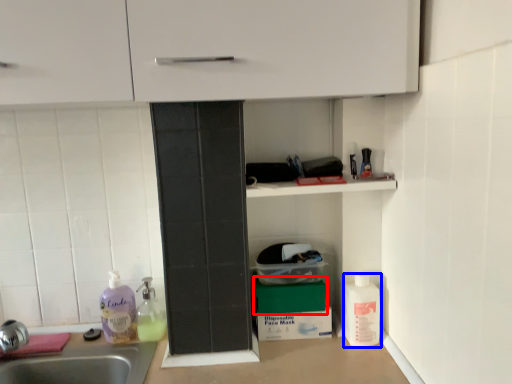
Question: Which object appears farthest to the camera in this image, box (highlighted by a red box) or cleaning product (highlighted by a blue box)?

Choices:
 (A) box
 (B) cleaning product

Answer: (A)